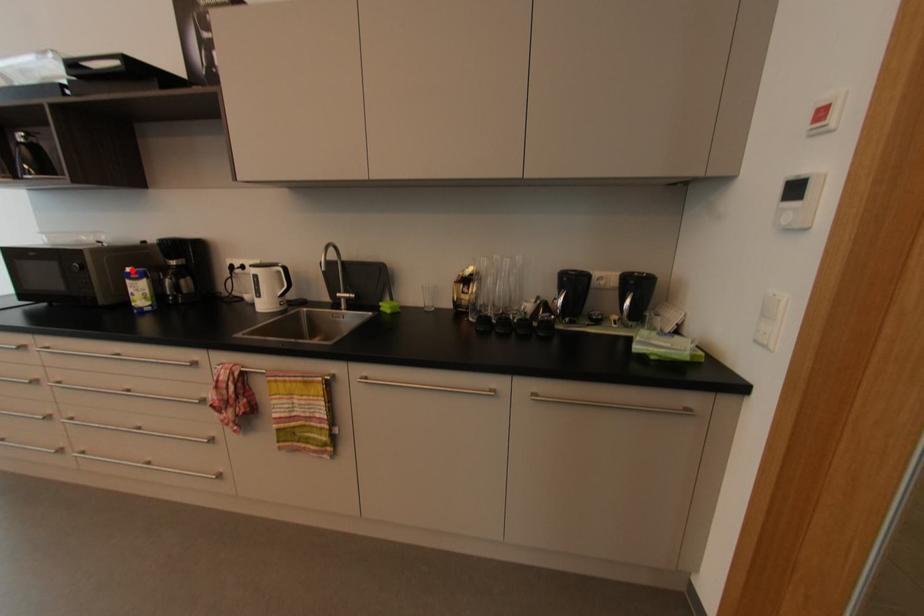
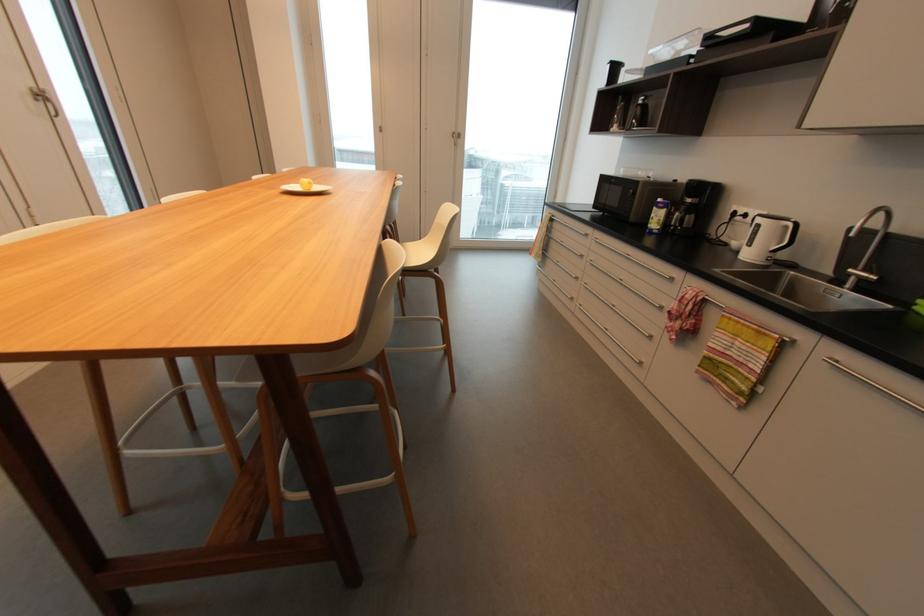
Question: I am providing you with two images of the same scene from different viewpoints. Image1 has a red point marked. In image2, the corresponding 3D location appears at what relative position? Reply with the corresponding letter.

Choices:
 (A) Closer
 (B) Farther

Answer: (A)